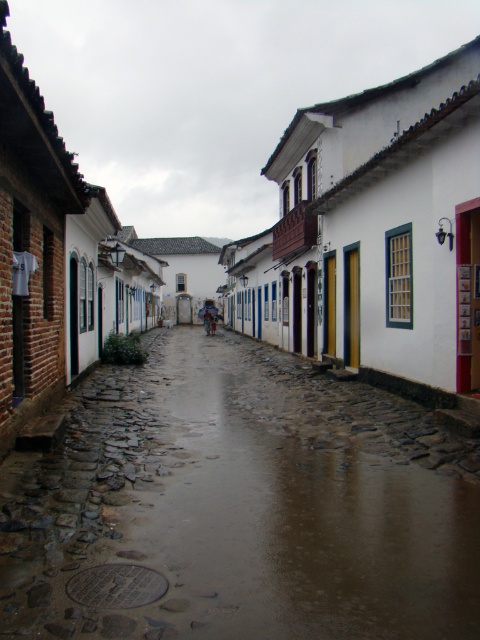
Is point (169, 426) farther from camera compared to point (435, 314)?

No, (169, 426) is closer to viewer.

Can you confirm if wet cobblestone alley at center is bigger than smooth cobblestone street at center?

Incorrect, wet cobblestone alley at center is not larger than smooth cobblestone street at center.

What do you see at coordinates (242, 504) in the screenshot?
I see `wet cobblestone alley at center` at bounding box center [242, 504].

The image size is (480, 640). In order to click on wet cobblestone alley at center in this screenshot , I will do `click(242, 504)`.